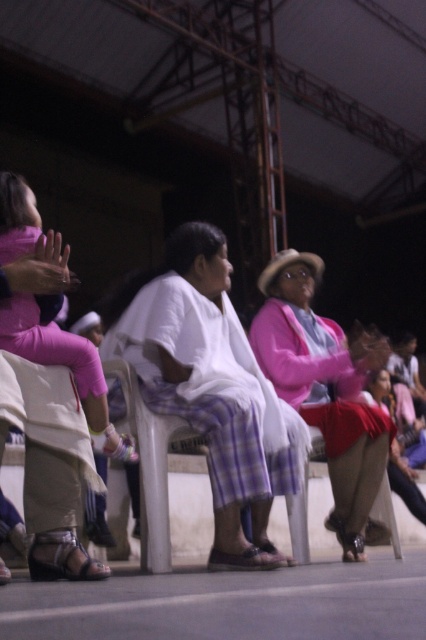
Looking at this image, you are a photographer at the event and want to capture both the pink fabric pants at left and the brown leather sandal at lower center in the same frame. Based on their positions, which object is positioned higher in the image?

The pink fabric pants at left is located above the brown leather sandal at lower center, so the pink fabric pants at left is positioned higher in the image.

You are organizing a photo shoot and need to place a small prop between the pink fabric pants at left and the brown leather sandal at lower center. Given their sizes, which object should the prop be placed closer to to ensure it doesn

The pink fabric pants at left is bigger than the brown leather sandal at lower center, so the prop should be placed closer to the pink fabric pants at left to ensure it is proportionally balanced.

You are a photographer trying to capture a candid shot of the pink fabric pants at left and the brown leather sandal at lower center. Which object should you focus on first if you want to include both in the frame without moving the camera? Explain your reasoning based on their positions.

The pink fabric pants at left should be focused on first because they are wider than the brown leather sandal at lower center, so capturing them first ensures both can fit within the frame.